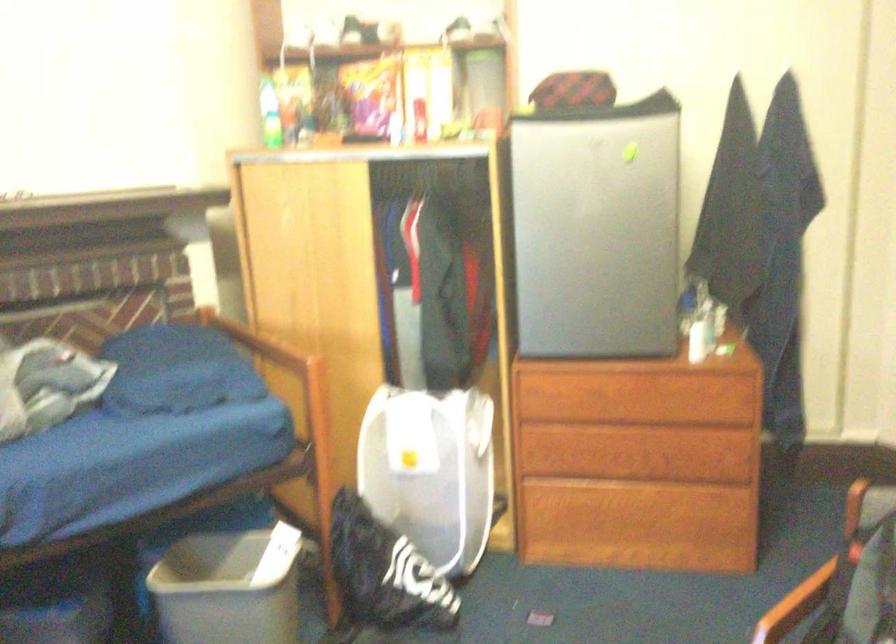
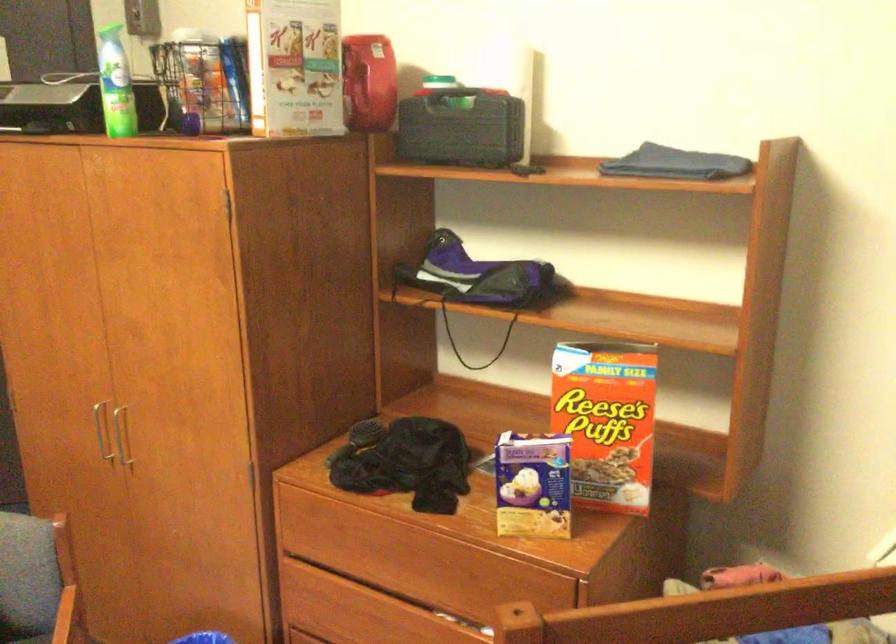
Question: The camera is either moving clockwise (left) or counter-clockwise (right) around the object. The first image is from the beginning of the video and the second image is from the end. Is the camera moving left or right when shooting the video?

Choices:
 (A) Left
 (B) Right

Answer: (A)